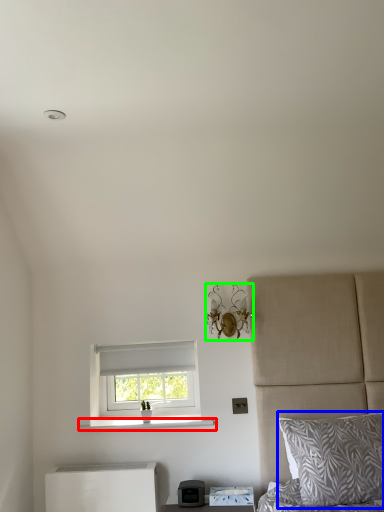
Question: Which object is the farthest from window sill (highlighted by a red box)? Choose among these: pillow (highlighted by a blue box) or light fixture (highlighted by a green box).

Choices:
 (A) pillow
 (B) light fixture

Answer: (A)